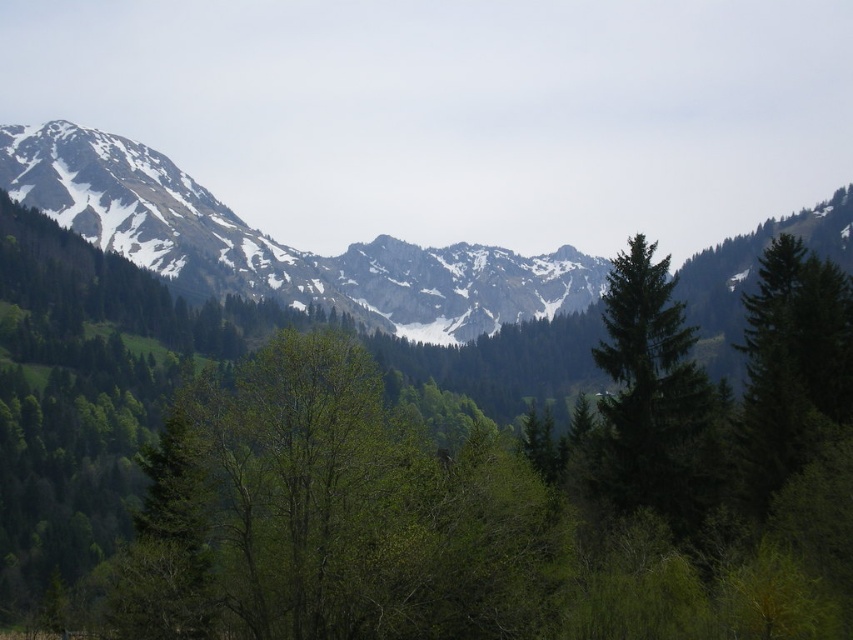
Between green leafy tree at center and green matte tree at center, which one appears on the left side from the viewer's perspective?

green leafy tree at center

Does point (839, 364) lie behind point (654, 324)?

Yes, it is.

Find the location of a particular element. green leafy tree at center is located at coordinates (489, 500).

Does point (25, 141) come closer to viewer compared to point (619, 502)?

That is False.

Is point (595, 292) behind point (670, 499)?

Yes, it is behind point (670, 499).

You are a GUI agent. You are given a task and a screenshot of the screen. Output one action in this format:
    pyautogui.click(x=<x>, y=<y>)
    Task: Click on the snowy rock mountain range at left
    This screenshot has height=640, width=853.
    Given the screenshot: What is the action you would take?
    pyautogui.click(x=277, y=244)

Does green leafy tree at center have a larger size compared to snowy rock mountain range at left?

Yes, green leafy tree at center is bigger than snowy rock mountain range at left.

Does green leafy tree at center appear on the left side of snowy rock mountain range at left?

Correct, you'll find green leafy tree at center to the left of snowy rock mountain range at left.

Between point (465, 572) and point (177, 225), which one is positioned in front?

Positioned in front is point (465, 572).

The width and height of the screenshot is (853, 640). Find the location of `green leafy tree at center`. green leafy tree at center is located at coordinates (489, 500).